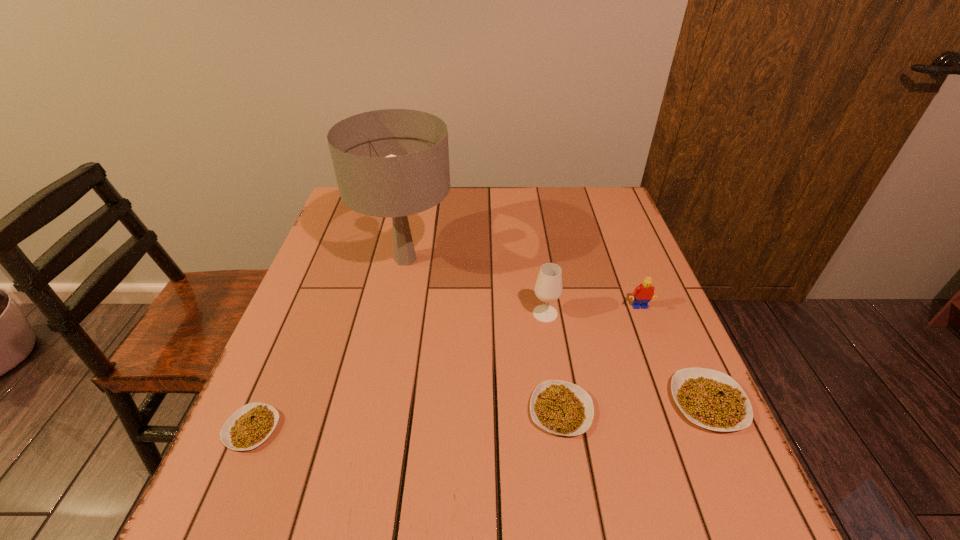
Image resolution: width=960 pixels, height=540 pixels. I want to click on vacant space located on the right of the shortest object, so click(427, 429).

The image size is (960, 540). What are the coordinates of `free space located on the back of the second shortest legume` in the screenshot? It's located at (541, 286).

You are a GUI agent. You are given a task and a screenshot of the screen. Output one action in this format:
    pyautogui.click(x=<x>, y=<y>)
    Task: Click on the vacant space situated on the left of the fourth tallest object
    
    Given the screenshot: What is the action you would take?
    pyautogui.click(x=498, y=402)

The image size is (960, 540). What are the coordinates of `free region located 0.100m on the front-facing side of the lampshade` in the screenshot? It's located at (491, 259).

The height and width of the screenshot is (540, 960). I want to click on vacant space situated on the left of the glass, so click(456, 314).

The width and height of the screenshot is (960, 540). In order to click on vacant space positioned 0.090m on the front-facing side of the fourth shortest object in this screenshot , I will do `click(651, 341)`.

You are a GUI agent. You are given a task and a screenshot of the screen. Output one action in this format:
    pyautogui.click(x=<x>, y=<y>)
    Task: Click on the legume located at the left edge
    This screenshot has width=960, height=540.
    Given the screenshot: What is the action you would take?
    pyautogui.click(x=252, y=424)

The image size is (960, 540). I want to click on lampshade at the left edge, so 394,163.

Identify the location of legume that is at the right edge. (711, 399).

This screenshot has height=540, width=960. I want to click on Lego present at the right edge, so click(x=643, y=293).